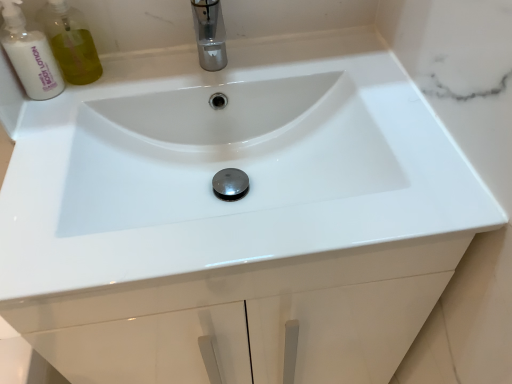
Describe the element at coordinates (209, 34) in the screenshot. Image resolution: width=512 pixels, height=384 pixels. I see `polished chrome tap at upper center` at that location.

Locate an element on the screen. polished chrome tap at upper center is located at coordinates (209, 34).

Locate an element on the screen. The height and width of the screenshot is (384, 512). white lotion at upper left is located at coordinates (29, 54).

The image size is (512, 384). Describe the element at coordinates (29, 54) in the screenshot. I see `white lotion at upper left` at that location.

What is the approximate height of white lotion at upper left?

white lotion at upper left is 6.25 inches in height.

At what (x,y) coordinates should I click in order to perform the action: click on polished chrome tap at upper center. Please return your answer as a coordinate pair (x, y). Looking at the image, I should click on click(209, 34).

Which is more to the right, white lotion at upper left or polished chrome tap at upper center?

polished chrome tap at upper center.

Is white lotion at upper left further to camera compared to polished chrome tap at upper center?

Yes, it is.

Is point (40, 50) in front of point (199, 13)?

Yes, point (40, 50) is in front of point (199, 13).

From the image's perspective, is white lotion at upper left above or below polished chrome tap at upper center?

Clearly, from the image's perspective, white lotion at upper left is below polished chrome tap at upper center.

From a real-world perspective, between white lotion at upper left and polished chrome tap at upper center, who is vertically higher?

white lotion at upper left.

Is white lotion at upper left wider than polished chrome tap at upper center?

No.

Can you confirm if white lotion at upper left is taller than polished chrome tap at upper center?

Indeed, white lotion at upper left has a greater height compared to polished chrome tap at upper center.

Considering the sizes of objects white lotion at upper left and polished chrome tap at upper center in the image provided, who is bigger, white lotion at upper left or polished chrome tap at upper center?

polished chrome tap at upper center is bigger.

Choose the correct answer: Is white lotion at upper left inside polished chrome tap at upper center or outside it?

The correct answer is: outside.

Would you say white lotion at upper left is a long distance from polished chrome tap at upper center?

They are positioned close to each other.

Is white lotion at upper left facing away from polished chrome tap at upper center?

No, white lotion at upper left is not facing the opposite direction of polished chrome tap at upper center.

How distant is white lotion at upper left from polished chrome tap at upper center?

white lotion at upper left and polished chrome tap at upper center are 10.68 inches apart from each other.

The image size is (512, 384). Find the location of `cleaning product to the left of polished chrome tap at upper center`. cleaning product to the left of polished chrome tap at upper center is located at coordinates (29, 54).

Which object is positioned more to the right, polished chrome tap at upper center or white lotion at upper left?

From the viewer's perspective, polished chrome tap at upper center appears more on the right side.

Is polished chrome tap at upper center in front of or behind white lotion at upper left in the image?

polished chrome tap at upper center is positioned closer to the viewer than white lotion at upper left.

Is point (208, 61) farther from viewer compared to point (13, 62)?

Yes.

From the image's perspective, relative to white lotion at upper left, is polished chrome tap at upper center above or below?

Clearly, from the image's perspective, polished chrome tap at upper center is above white lotion at upper left.

From a real-world perspective, is polished chrome tap at upper center located beneath white lotion at upper left?

Yes.

Is polished chrome tap at upper center wider than white lotion at upper left?

Yes, polished chrome tap at upper center is wider than white lotion at upper left.

Who is taller, polished chrome tap at upper center or white lotion at upper left?

Standing taller between the two is white lotion at upper left.

Which of these two, polished chrome tap at upper center or white lotion at upper left, is bigger?

polished chrome tap at upper center is bigger.

Which is correct: polished chrome tap at upper center is inside white lotion at upper left, or outside of it?

polished chrome tap at upper center is spatially situated outside white lotion at upper left.

Is polished chrome tap at upper center far away from white lotion at upper left?

Answer: They are positioned close to each other.

Is polished chrome tap at upper center oriented away from white lotion at upper left?

No, polished chrome tap at upper center is not facing the opposite direction of white lotion at upper left.

This screenshot has height=384, width=512. I want to click on cleaning product below the polished chrome tap at upper center (from the image's perspective), so click(29, 54).

Find the location of a particular element. tap above the white lotion at upper left (from the image's perspective) is located at coordinates (209, 34).

The image size is (512, 384). In order to click on cleaning product that is on the left side of polished chrome tap at upper center in this screenshot , I will do `click(29, 54)`.